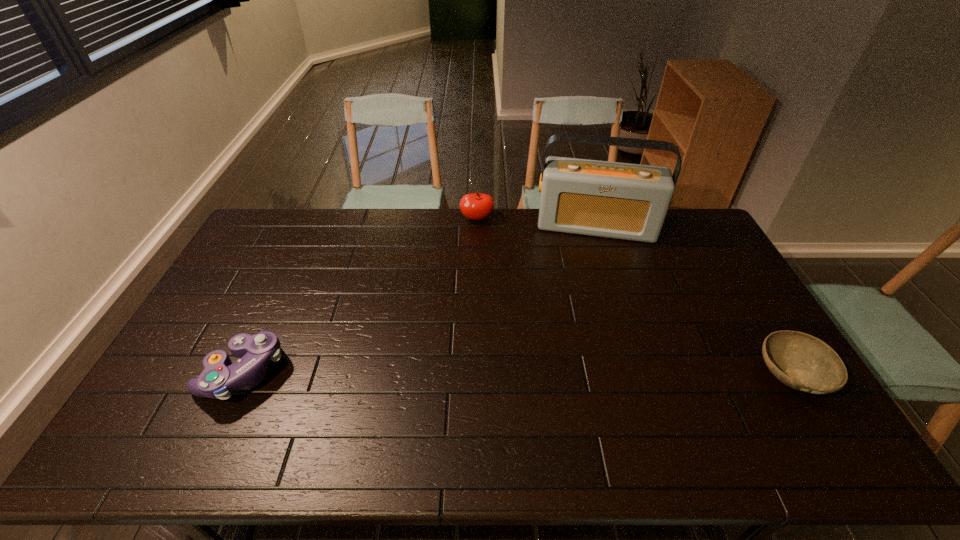
At what (x,y) coordinates should I click in order to perform the action: click on free space between the leftmost object and the rightmost object. Please return your answer as a coordinate pair (x, y). Looking at the image, I should click on (517, 373).

Locate an element on the screen. This screenshot has width=960, height=540. vacant space that is in between the leftmost object and the tallest object is located at coordinates (420, 299).

The width and height of the screenshot is (960, 540). What are the coordinates of `vacant space in between the radio receiver and the rightmost object` in the screenshot? It's located at (694, 301).

In order to click on free spot between the control and the bowl in this screenshot , I will do `click(517, 373)`.

The width and height of the screenshot is (960, 540). Find the location of `free point between the apple and the third object from left to right`. free point between the apple and the third object from left to right is located at coordinates click(537, 223).

Identify the location of empty space between the second shortest object and the second object from left to right. (360, 295).

Identify the location of empty space that is in between the third tallest object and the third object from right to left. The height and width of the screenshot is (540, 960). (360, 295).

The width and height of the screenshot is (960, 540). I want to click on free spot between the tallest object and the bowl, so click(x=694, y=301).

Locate an element on the screen. This screenshot has height=540, width=960. the third closest object to the second object from right to left is located at coordinates (220, 377).

Locate an element on the screen. The image size is (960, 540). object that is the third closest to the radio receiver is located at coordinates (220, 377).